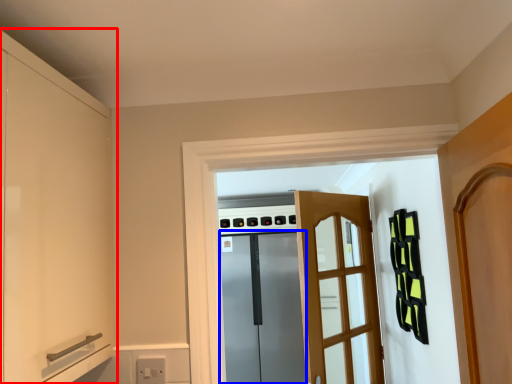
Question: Among these objects, which one is farthest to the camera, cabinetry (highlighted by a red box) or screen door (highlighted by a blue box)?

Choices:
 (A) cabinetry
 (B) screen door

Answer: (B)